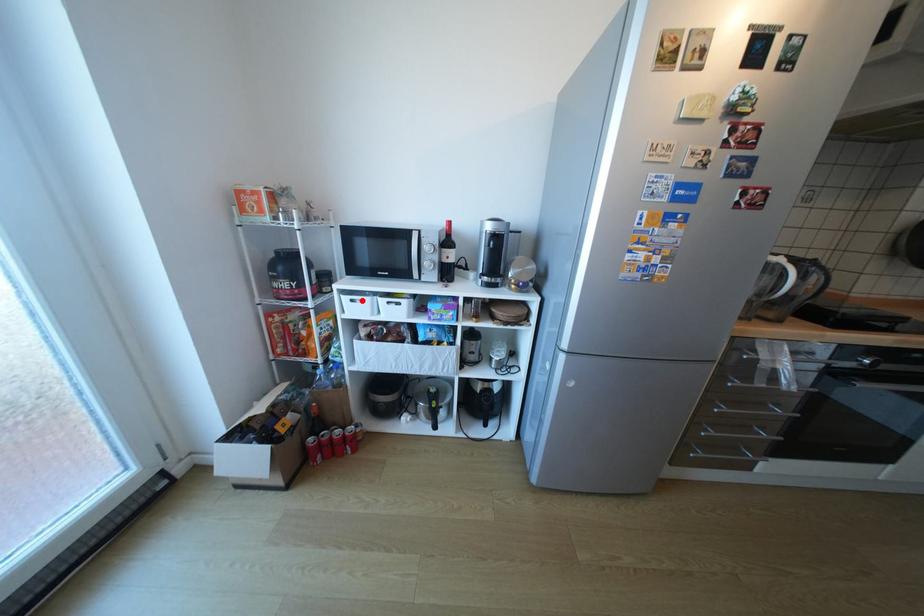
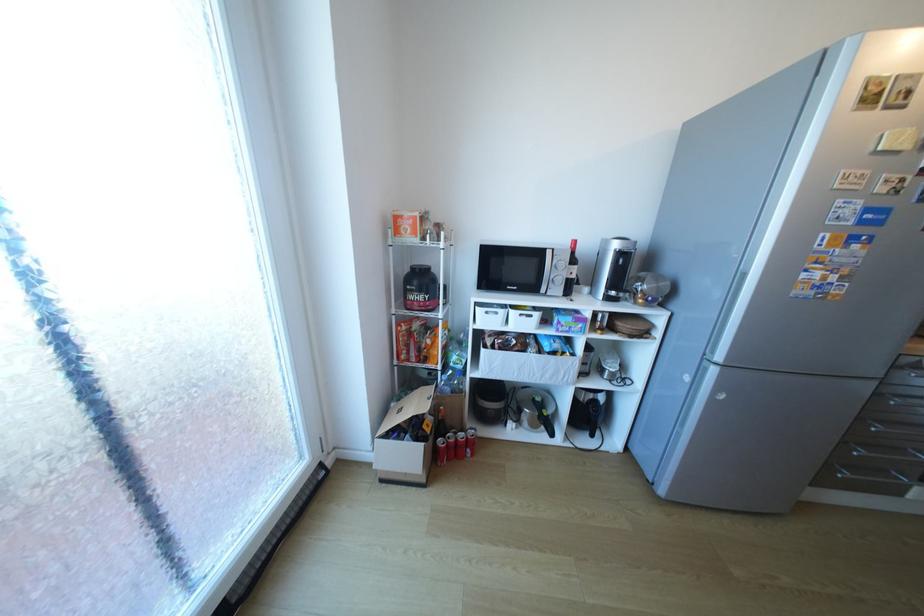
Where in the second image is the point corresponding to the highlighted location from the first image?

(495, 313)